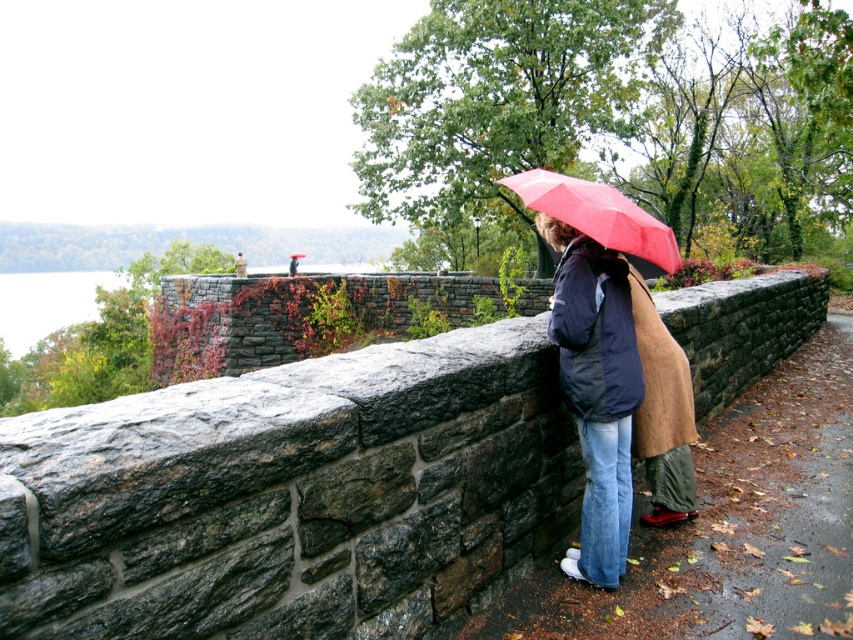
You are a painter planning to sketch this scene. You want to ensure the stone wall at center and the matte red umbrella at upper center are proportionally accurate. Which object should you draw first to maintain proper proportions, considering their widths?

The stone wall at center has a lesser width compared to the matte red umbrella at upper center. Therefore, you should draw the stone wall at center first since it is narrower, ensuring there is enough space to accommodate the wider matte red umbrella at upper center.

You are standing at the point marked by coordinates point (618, 396) in the image. What object is located exactly at this point?

The point (618, 396) corresponds to the location of the matte black jacket at center.

You are standing in the outdoor scene and want to take a photo of the stone wall at center. Which direction should you face to ensure the wall is fully visible in your camera view?

The stone wall at center is located at point (x=292, y=493), so you should face towards the center of the image to capture the wall fully.